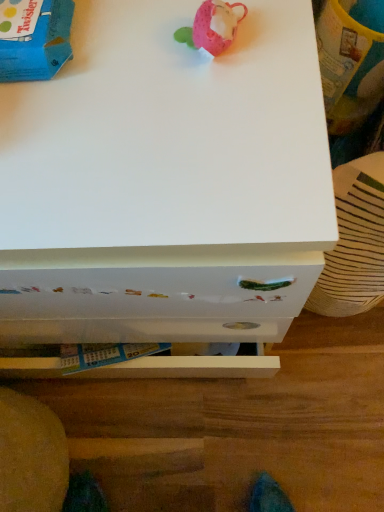
The height and width of the screenshot is (512, 384). Identify the location of free spot in front of pink fabric mouse at upper center, the 2th toy from the left. (231, 150).